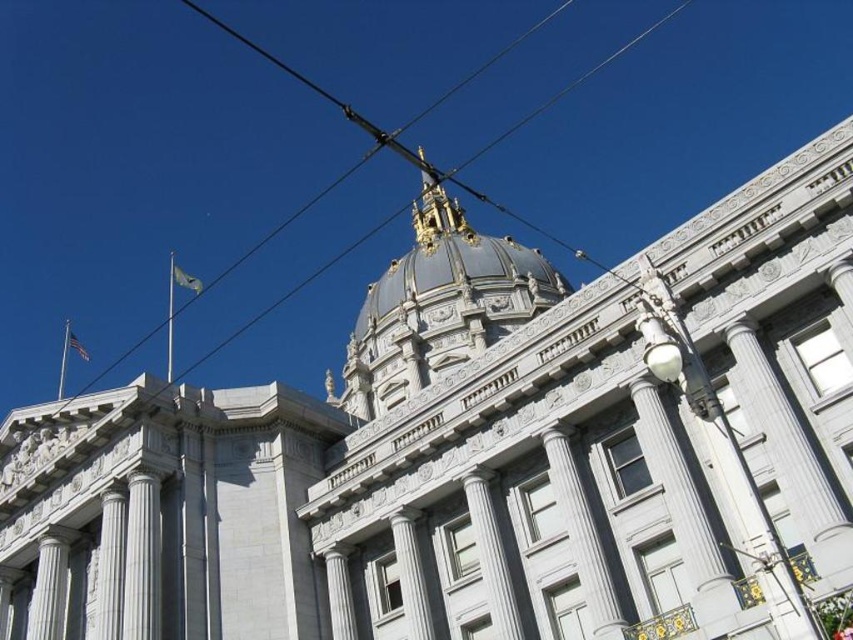
You are a delivery drone flying towards the grand neoclassical building. You notice two objects in your path. Which one is higher in the sky between the metallic wire at upper center and the blue fabric flag at upper left?

The metallic wire at upper center is located above the blue fabric flag at upper left, so the metallic wire at upper center is higher in the sky.

You are standing at the entrance of the grand neoclassical building and want to take a photo of the white marble column at center. If you move 0.1 units to the right along the horizontal axis, will the column still be in your camera frame?

The white marble column at center is located at point 0.875 on the horizontal axis. Moving 0.1 units to the right would position you at 0.975, which is beyond the column, so it might still be in frame depending on your camera angle and field of view. However, since the column is at center, moving right might shift it out of the central focus but not necessarily out of the frame entirely. Without specific camera parameters, it is hard to determine precisely, but generally, it should remain visible unless the

You are an urban planner assessing the space between the metallic wire at upper center and the blue fabric flag at upper left. Which object has a greater width?

The metallic wire at upper center might be wider than blue fabric flag at upper left, so the metallic wire at upper center likely has a greater width.